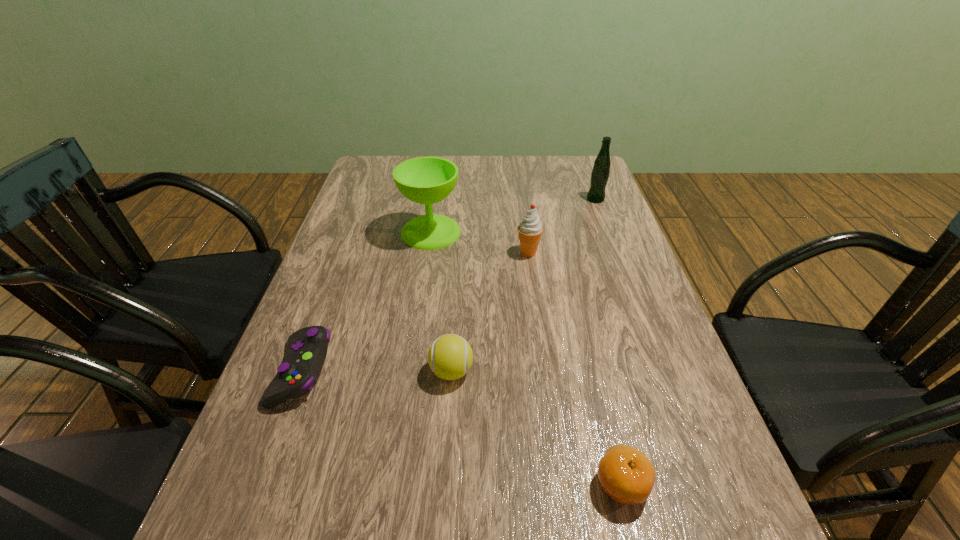
Where is `free space located on the left of the wineglass`? The image size is (960, 540). free space located on the left of the wineglass is located at coordinates (380, 232).

The image size is (960, 540). I want to click on vacant space situated on the back of the icecream, so click(x=519, y=185).

At what (x,y) coordinates should I click in order to perform the action: click on blank space located 0.290m on the left of the fourth tallest object. Please return your answer as a coordinate pair (x, y). Looking at the image, I should click on (289, 371).

Locate an element on the screen. Image resolution: width=960 pixels, height=540 pixels. blank area located 0.120m on the back of the fifth object from left to right is located at coordinates (601, 399).

Image resolution: width=960 pixels, height=540 pixels. Identify the location of blank space located on the back of the control. (336, 280).

Locate an element on the screen. Image resolution: width=960 pixels, height=540 pixels. object at the left edge is located at coordinates (302, 365).

At what (x,y) coordinates should I click in order to perform the action: click on beer bottle positioned at the right edge. Please return your answer as a coordinate pair (x, y). Image resolution: width=960 pixels, height=540 pixels. Looking at the image, I should click on (600, 173).

Locate an element on the screen. The height and width of the screenshot is (540, 960). clementine located in the right edge section of the desktop is located at coordinates (624, 473).

Identify the location of vacant space at the far edge of the desktop. (467, 165).

In the image, there is a desktop. Identify the location of vacant space at the left edge. Image resolution: width=960 pixels, height=540 pixels. point(397,207).